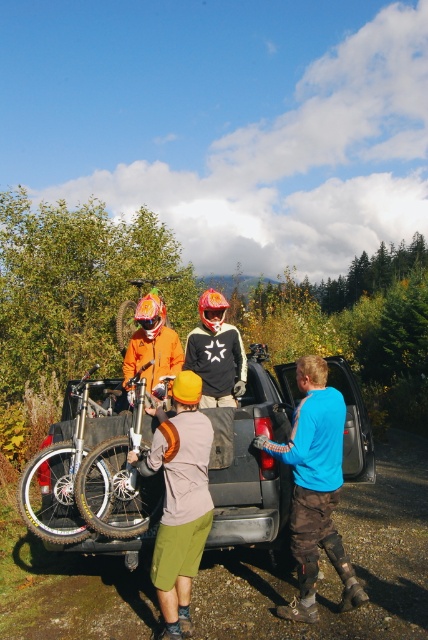
Question: Does metallic silver truck at center come in front of blue fabric truck at center?

Choices:
 (A) yes
 (B) no

Answer: (B)

Question: Can you confirm if metallic silver truck at center is positioned above blue fabric truck at center?

Choices:
 (A) yes
 (B) no

Answer: (A)

Question: Which point is closer to the camera taking this photo?

Choices:
 (A) (124, 419)
 (B) (163, 276)
 (C) (339, 474)

Answer: (C)

Question: Does metallic silver truck at center appear on the right side of blue fabric truck at center?

Choices:
 (A) no
 (B) yes

Answer: (A)

Question: Which point appears farthest from the camera in this image?

Choices:
 (A) (160, 280)
 (B) (231, 532)
 (C) (345, 589)

Answer: (A)

Question: Among these objects, which one is farthest from the camera?

Choices:
 (A) metallic silver truck at center
 (B) blue fabric truck at center

Answer: (A)